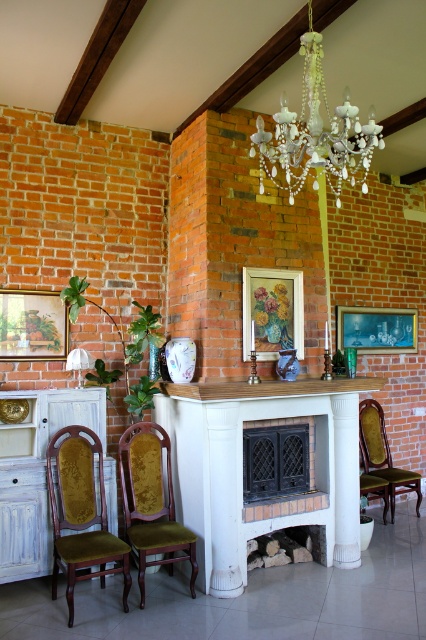
Is white wood fireplace at center taller than velvet/golden-brown chair at left?

Correct, white wood fireplace at center is much taller as velvet/golden-brown chair at left.

Between point (161, 387) and point (109, 536), which one is positioned behind?

Point (161, 387)

Identify the location of white wood fireplace at center. Image resolution: width=426 pixels, height=640 pixels. (241, 468).

Who is positioned more to the left, wooden framed picture at center or wooden picture frame at left?

wooden picture frame at left is more to the left.

Describe the element at coordinates (273, 310) in the screenshot. This screenshot has height=640, width=426. I see `wooden framed picture at center` at that location.

Who is more distant from viewer, (250, 275) or (37, 316)?

The point (250, 275) is behind.

Locate an element on the screen. wooden framed picture at center is located at coordinates (273, 310).

Who is shorter, velvet/golden-brown chair at left or wooden framed picture at center?

Standing shorter between the two is wooden framed picture at center.

Is velvet/golden-brown chair at left further to camera compared to wooden framed picture at center?

No, it is in front of wooden framed picture at center.

The image size is (426, 640). Describe the element at coordinates (80, 513) in the screenshot. I see `velvet/golden-brown chair at left` at that location.

Where is `velvet/golden-brown chair at left`? Image resolution: width=426 pixels, height=640 pixels. velvet/golden-brown chair at left is located at coordinates (80, 513).